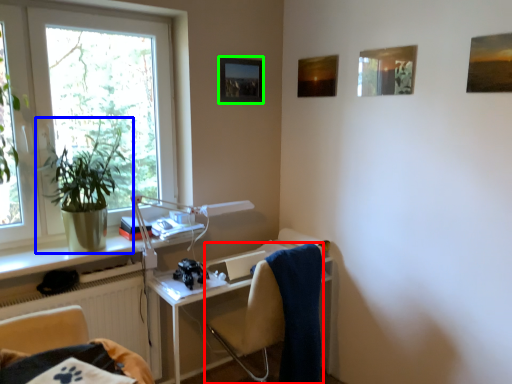
Question: Estimate the real-world distances between objects in this image. Which object is farther from chair (highlighted by a red box), houseplant (highlighted by a blue box) or picture frame (highlighted by a green box)?

Choices:
 (A) houseplant
 (B) picture frame

Answer: (B)